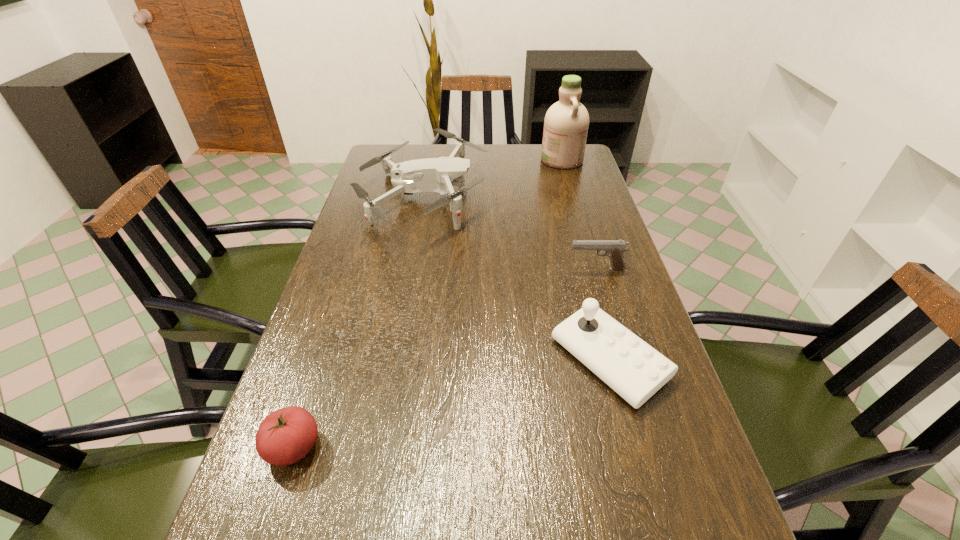
Identify the location of pistol at the right edge. The width and height of the screenshot is (960, 540). (614, 249).

Where is `object that is at the far left corner`? object that is at the far left corner is located at coordinates point(432,174).

Locate an element on the screen. object that is at the far right corner is located at coordinates (566, 123).

The height and width of the screenshot is (540, 960). I want to click on blank space at the far edge of the desktop, so click(468, 148).

You are a GUI agent. You are given a task and a screenshot of the screen. Output one action in this format:
    pyautogui.click(x=<x>, y=<y>)
    Task: Click on the free region at the left edge of the desktop
    The image size is (960, 540).
    Given the screenshot: What is the action you would take?
    pyautogui.click(x=314, y=368)

In the image, there is a desktop. Where is `free space at the right edge`? free space at the right edge is located at coordinates (635, 476).

What are the coordinates of `free location at the far left corner` in the screenshot? It's located at (412, 147).

Find the location of a particular element. The image size is (960, 540). free space between the fifth farthest object and the third nearest object is located at coordinates (451, 403).

What are the coordinates of `free space between the third nearest object and the drone` in the screenshot? It's located at (516, 279).

Image resolution: width=960 pixels, height=540 pixels. Identify the location of empty space that is in between the drone and the fourth nearest object. (510, 234).